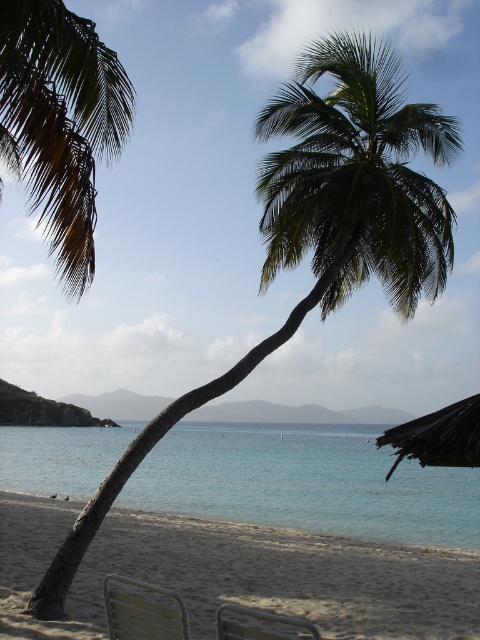
Is clear blue water at lower center bigger than metallic silver chair at lower center?

Yes, clear blue water at lower center is bigger than metallic silver chair at lower center.

Where is `clear blue water at lower center`? The image size is (480, 640). clear blue water at lower center is located at coordinates (307, 483).

Can you confirm if clear blue water at lower center is positioned above dark brown wooden umbrella at lower right?

No.

Does point (180, 484) lie behind point (435, 435)?

That is True.

Image resolution: width=480 pixels, height=640 pixels. In order to click on clear blue water at lower center in this screenshot , I will do `click(307, 483)`.

Which is below, metallic silver beach chair at lower center or metallic silver chair at lower center?

metallic silver chair at lower center

Which of these two, metallic silver beach chair at lower center or metallic silver chair at lower center, stands taller?

Standing taller between the two is metallic silver chair at lower center.

Which is behind, point (132, 634) or point (314, 637)?

The point (132, 634) is more distant.

Locate an element on the screen. This screenshot has width=480, height=640. metallic silver beach chair at lower center is located at coordinates (143, 612).